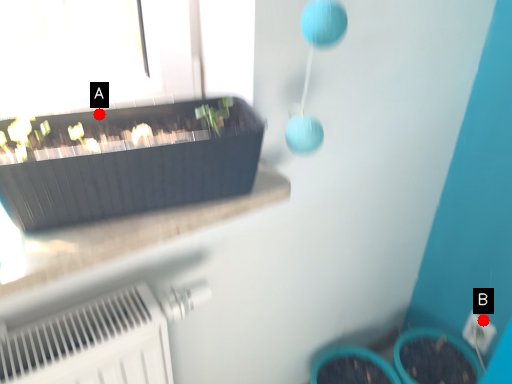
Question: Two points are circled on the image, labeled by A and B beside each circle. Which point is further to the camera?

Choices:
 (A) A is further
 (B) B is further

Answer: (B)